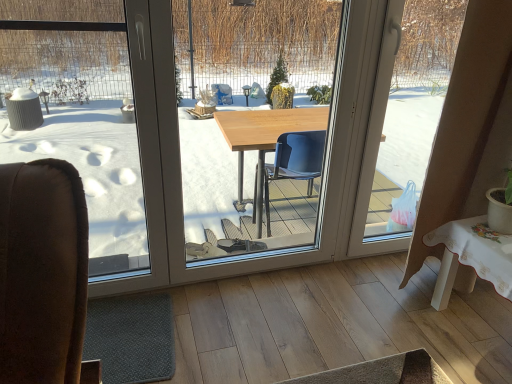
Question: Considering the relative sizes of transparent glass window at left, the 3th window screen positioned from the right, and transparent plastic bag at right, the third window screen when ordered from left to right, in the image provided, is transparent glass window at left, the 3th window screen positioned from the right, thinner than transparent plastic bag at right, the third window screen when ordered from left to right,?

Choices:
 (A) no
 (B) yes

Answer: (A)

Question: Considering the relative positions of transparent glass window at left, the 1th window screen when ordered from left to right, and transparent plastic bag at right, which is the first window screen in right-to-left order, in the image provided, is transparent glass window at left, the 1th window screen when ordered from left to right, to the right of transparent plastic bag at right, which is the first window screen in right-to-left order, from the viewer's perspective?

Choices:
 (A) yes
 (B) no

Answer: (B)

Question: From the image's perspective, is transparent glass window at left, the 1th window screen when ordered from left to right, above transparent plastic bag at right, which is the first window screen in right-to-left order?

Choices:
 (A) yes
 (B) no

Answer: (B)

Question: Is transparent glass window at left, the 3th window screen positioned from the right, bigger than transparent plastic bag at right, the third window screen when ordered from left to right?

Choices:
 (A) no
 (B) yes

Answer: (B)

Question: Considering the relative sizes of transparent glass window at left, the 1th window screen when ordered from left to right, and transparent plastic bag at right, which is the first window screen in right-to-left order, in the image provided, is transparent glass window at left, the 1th window screen when ordered from left to right, wider than transparent plastic bag at right, which is the first window screen in right-to-left order,?

Choices:
 (A) no
 (B) yes

Answer: (B)

Question: Considering their positions, is wooden table at center, arranged as the 2th window screen when viewed from the right, located in front of or behind transparent plastic bag at right, which is the first window screen in right-to-left order?

Choices:
 (A) behind
 (B) front

Answer: (B)

Question: Is wooden table at center, acting as the second window screen starting from the left, wider or thinner than transparent plastic bag at right, the third window screen when ordered from left to right?

Choices:
 (A) wide
 (B) thin

Answer: (B)

Question: From the image's perspective, is wooden table at center, acting as the second window screen starting from the left, located above or below transparent plastic bag at right, the third window screen when ordered from left to right?

Choices:
 (A) above
 (B) below

Answer: (B)

Question: Would you say wooden table at center, acting as the second window screen starting from the left, is inside or outside transparent plastic bag at right, which is the first window screen in right-to-left order?

Choices:
 (A) inside
 (B) outside

Answer: (B)

Question: Relative to transparent plastic bag at right, the third window screen when ordered from left to right, is transparent glass window at left, the 1th window screen when ordered from left to right, in front or behind?

Choices:
 (A) front
 (B) behind

Answer: (A)

Question: From a real-world perspective, relative to transparent plastic bag at right, the third window screen when ordered from left to right, is transparent glass window at left, the 3th window screen positioned from the right, vertically above or below?

Choices:
 (A) above
 (B) below

Answer: (B)

Question: Is transparent glass window at left, the 1th window screen when ordered from left to right, wider or thinner than transparent plastic bag at right, which is the first window screen in right-to-left order?

Choices:
 (A) wide
 (B) thin

Answer: (A)

Question: In the image, is transparent glass window at left, the 1th window screen when ordered from left to right, on the left side or the right side of transparent plastic bag at right, the third window screen when ordered from left to right?

Choices:
 (A) left
 (B) right

Answer: (A)

Question: Is point (416, 130) closer or farther from the camera than point (244, 114)?

Choices:
 (A) farther
 (B) closer

Answer: (B)

Question: From a real-world perspective, relative to wooden table at center, acting as the second window screen starting from the left, is transparent plastic bag at right, which is the first window screen in right-to-left order, vertically above or below?

Choices:
 (A) above
 (B) below

Answer: (B)